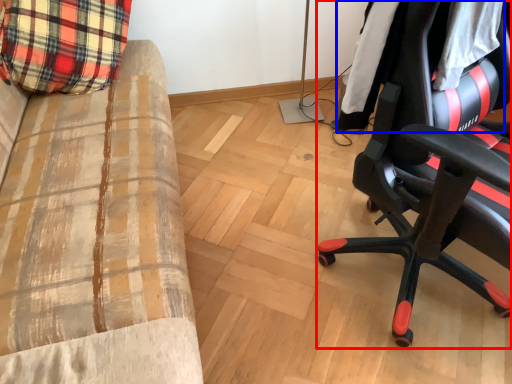
Question: Which object appears closest to the camera in this image, chair (highlighted by a red box) or clothing (highlighted by a blue box)?

Choices:
 (A) chair
 (B) clothing

Answer: (A)